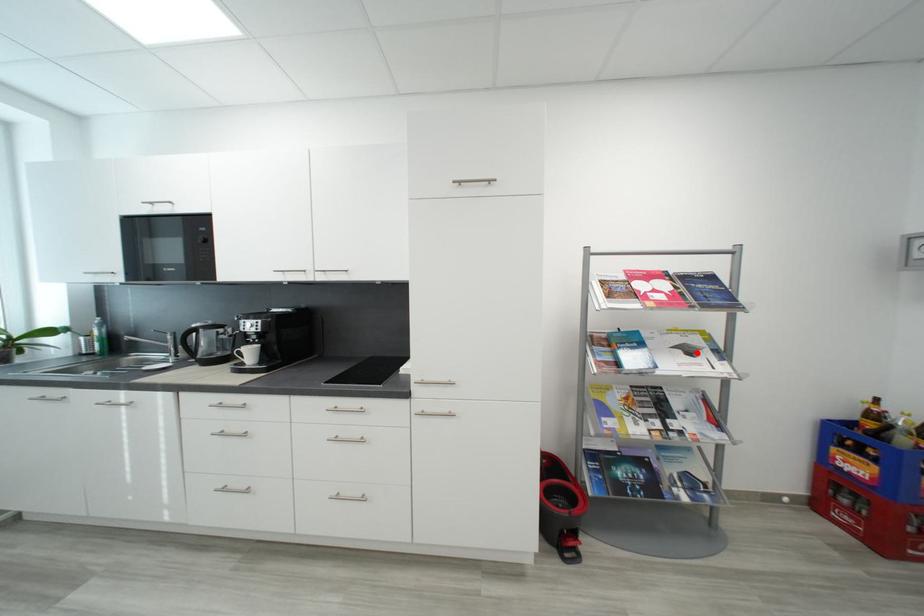
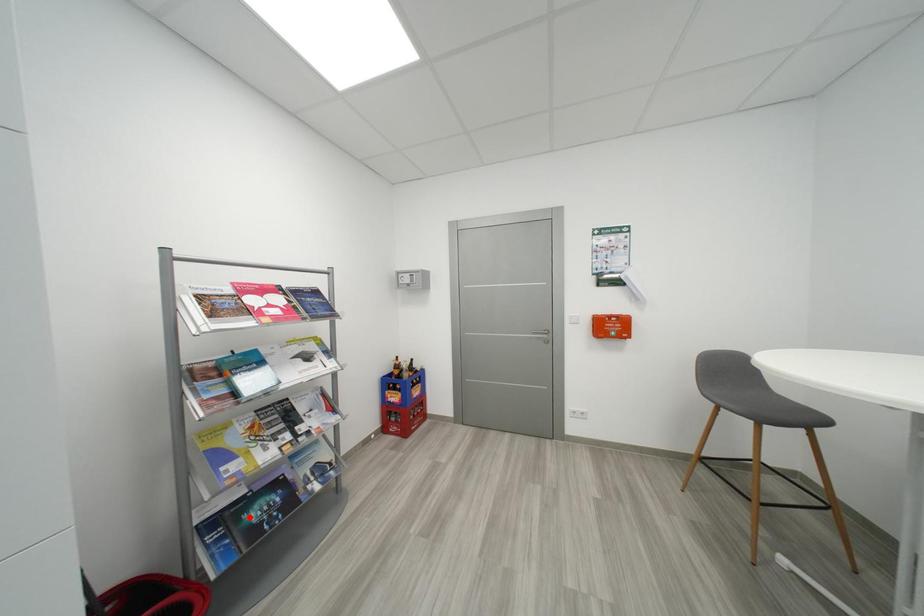
I am providing you with two images of the same scene from different viewpoints. A red point is marked on the first image and another point is marked on the second image. Does the point marked in image1 correspond to the same location as the one in image2?

No